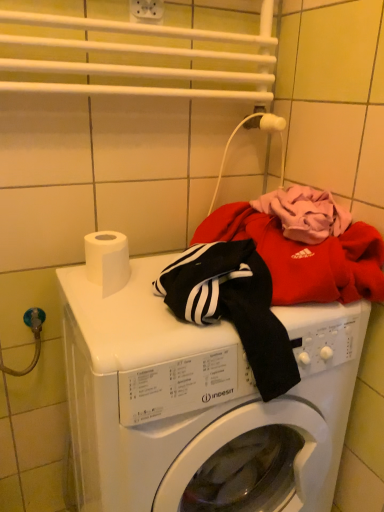
This screenshot has width=384, height=512. Find the location of `free space in front of white matte toilet paper at top left`. free space in front of white matte toilet paper at top left is located at coordinates (120, 320).